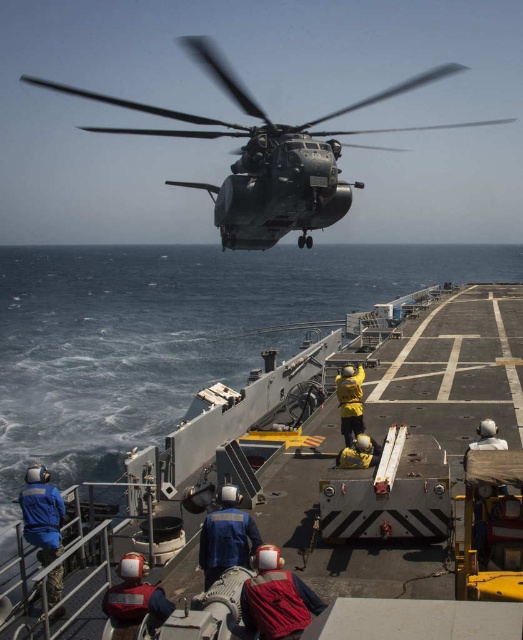
You are a crew member on the ship and need to retrieve the yellow matte helmet at center. The metallic gray boat at center is blocking your path. Can you move around the boat to reach the helmet?

The metallic gray boat at center is positioned under the yellow matte helmet at center, meaning the boat is below the helmet. Since the boat is on the deck and the helmet is likely on the deck above or near it, you can move around the boat to reach the helmet as they are on the same level.

Based on the photo, you are a new sailor on the deck of the ship and need to locate the safety equipment. You see the blue fabric sailor at lower left and the yellow matte helmet at center. Which object is closer to the left side of the deck?

The blue fabric sailor at lower left is closer to the left side of the deck because it is positioned to the left of the yellow matte helmet at center.